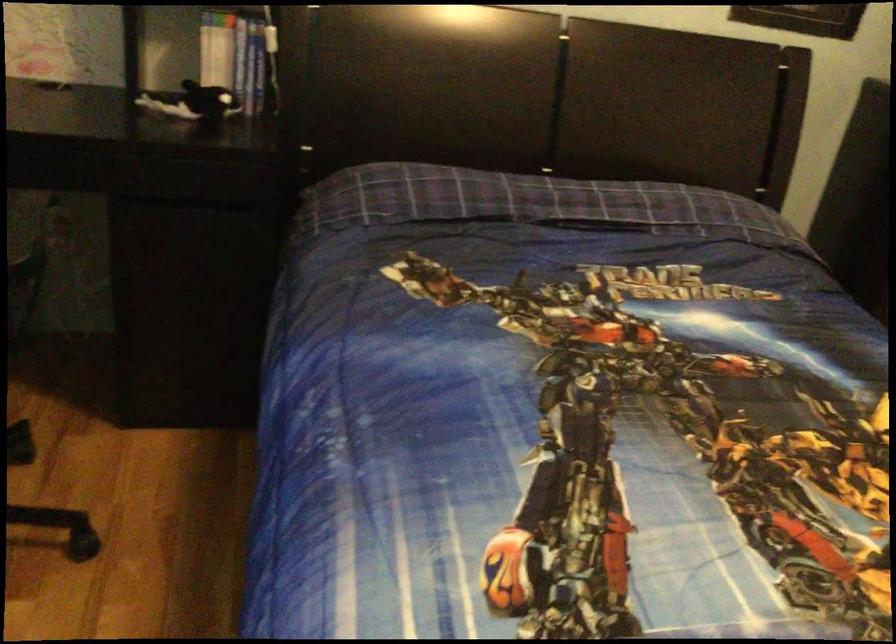
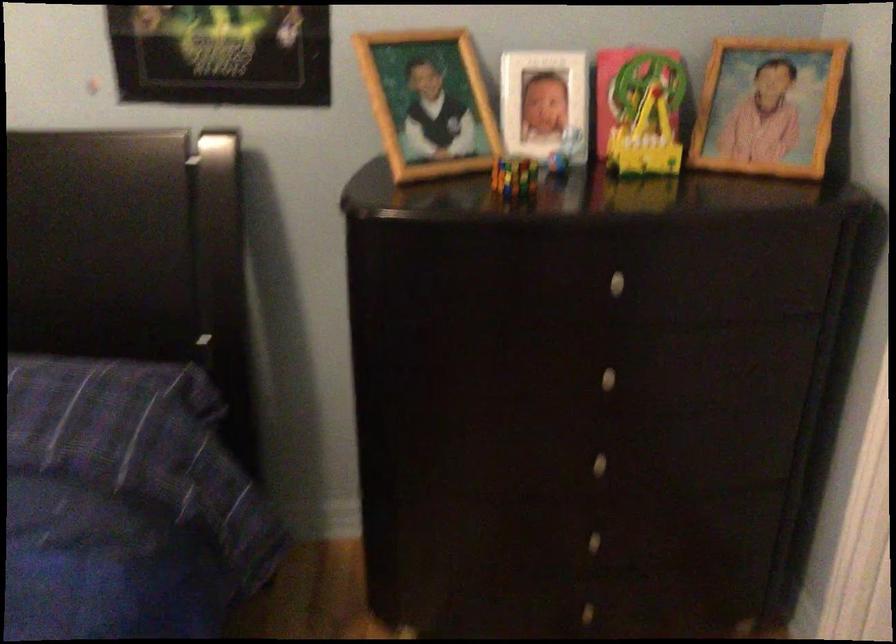
In a continuous first-person perspective shot, in which direction is the camera moving?

The movement direction of the cameraman is right, forward.